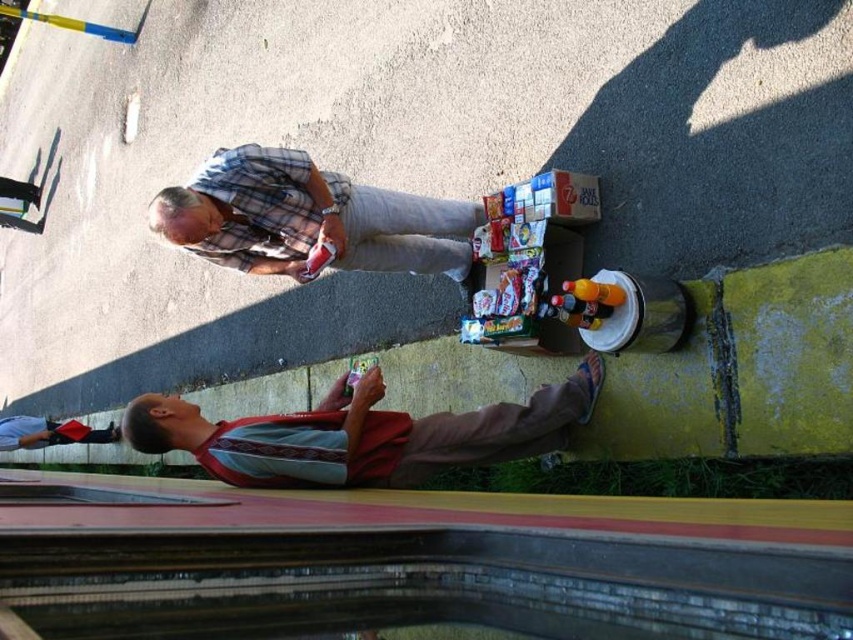
You are a delivery person trying to locate the two points in the image. Which of the two points, point (538, 440) or point (230, 156), is closer to you?

Point (230, 156) is closer to you because it is nearer to the camera than point (538, 440).

You are taking a photo of the two people and the cart. The camera is at your eye level. Which of the two points, point (258, 236) or point (16, 442), will appear larger in the photo?

Point (258, 236) is closer to the camera than point (16, 442), so it will appear larger in the photo.